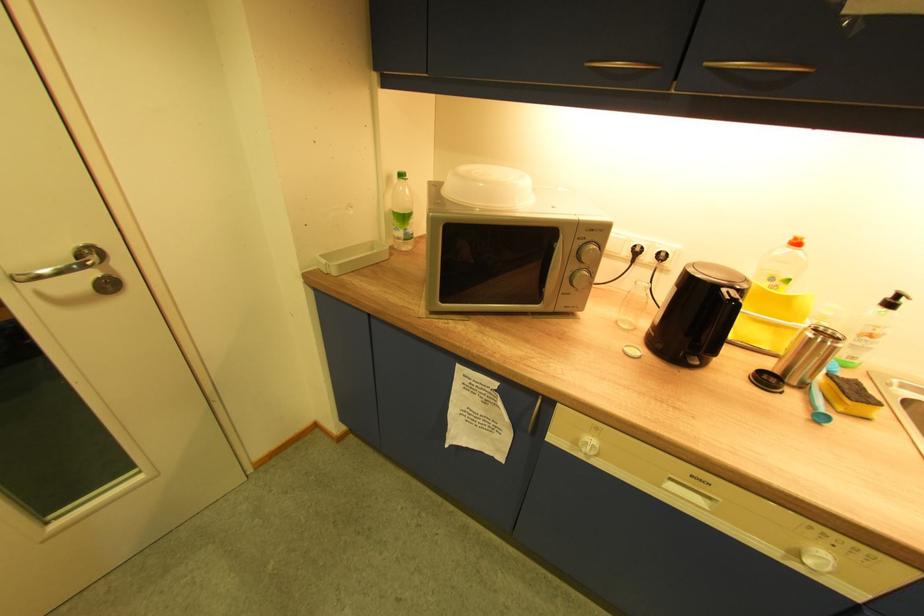
The image size is (924, 616). What are the coordinates of `microwave dial` in the screenshot? It's located at [589, 253].